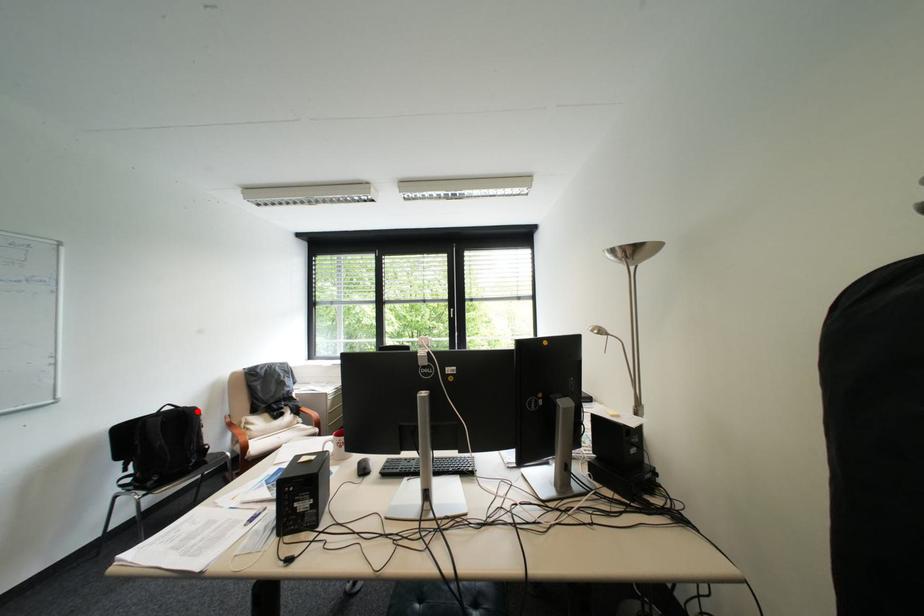
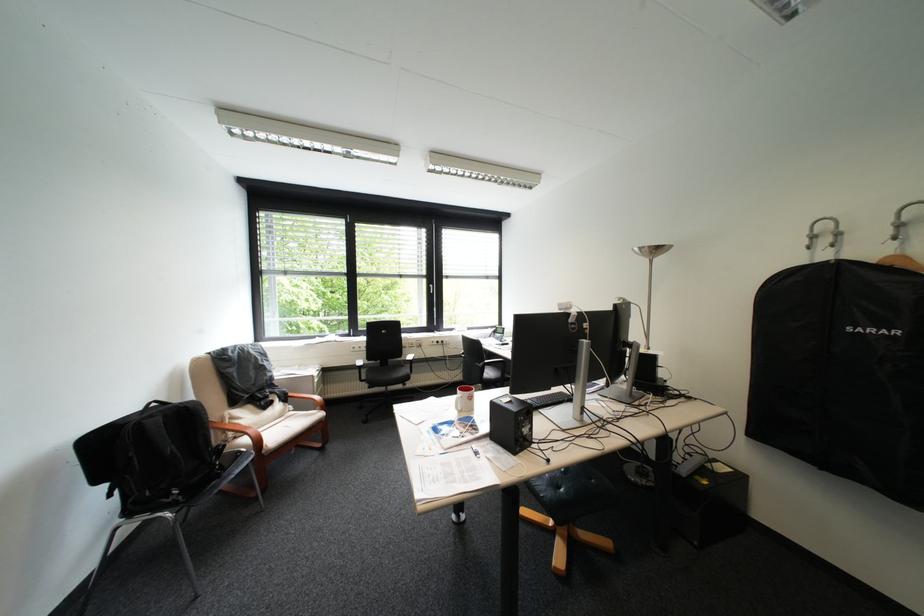
The point at the highlighted location is marked in the first image. Where is the corresponding point in the second image?

(199, 407)